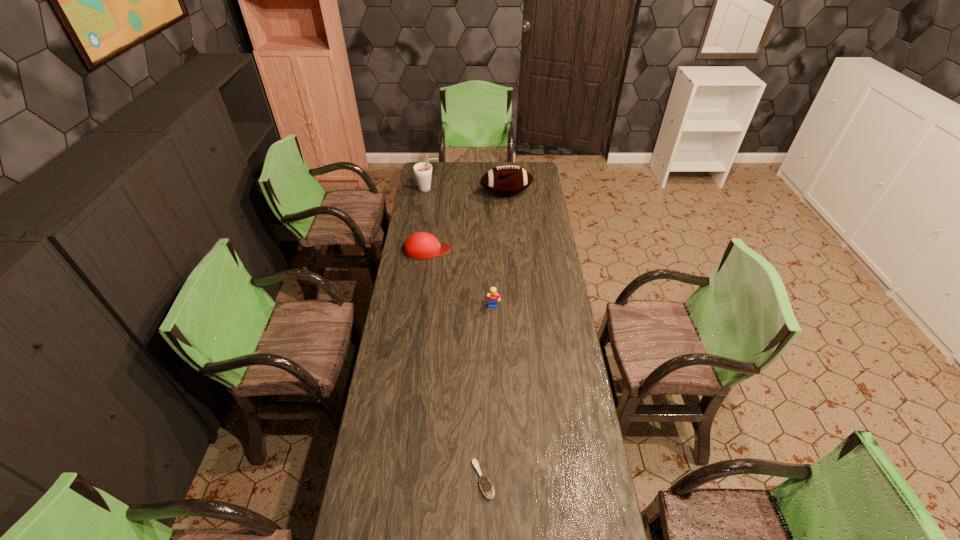
Identify the location of vacant space that's between the root beer and the football (American). This screenshot has height=540, width=960. (467, 192).

Locate an element on the screen. vacant area between the root beer and the shortest object is located at coordinates tap(455, 334).

This screenshot has height=540, width=960. What are the coordinates of `vacant space in between the second nearest object and the football (American)` in the screenshot? It's located at (500, 251).

The image size is (960, 540). What are the coordinates of `free space between the football (American) and the scrubbing brush` in the screenshot? It's located at (494, 337).

Locate an element on the screen. Image resolution: width=960 pixels, height=540 pixels. vacant space that is in between the nearest object and the second nearest object is located at coordinates (488, 394).

Locate an element on the screen. vacant region between the Lego and the root beer is located at coordinates (461, 248).

The height and width of the screenshot is (540, 960). I want to click on free point between the root beer and the scrubbing brush, so click(455, 334).

Locate which object is the fourth closest to the football (American). Please provide its 2D coordinates. Your answer should be formatted as a tuple, i.e. [(x, y)], where the tuple contains the x and y coordinates of a point satisfying the conditions above.

[(485, 485)]

Image resolution: width=960 pixels, height=540 pixels. I want to click on object that can be found as the second closest to the football (American), so click(420, 245).

You are a GUI agent. You are given a task and a screenshot of the screen. Output one action in this format:
    pyautogui.click(x=<x>, y=<y>)
    Task: Click on the free location that satisfies the following two spatial constraints: 1. on the drink side of the root beer; 2. on the right side of the nearest object
    The image size is (960, 540).
    Given the screenshot: What is the action you would take?
    pyautogui.click(x=383, y=480)